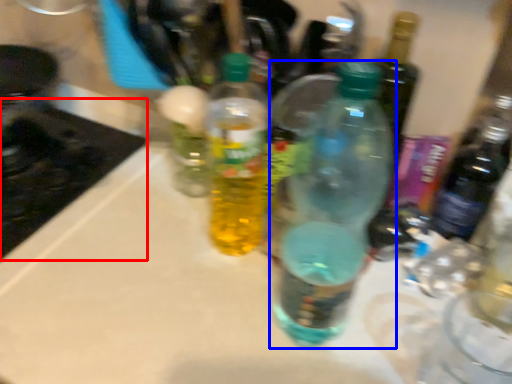
Question: Which object is further to the camera taking this photo, appliance (highlighted by a red box) or bottle (highlighted by a blue box)?

Choices:
 (A) appliance
 (B) bottle

Answer: (A)